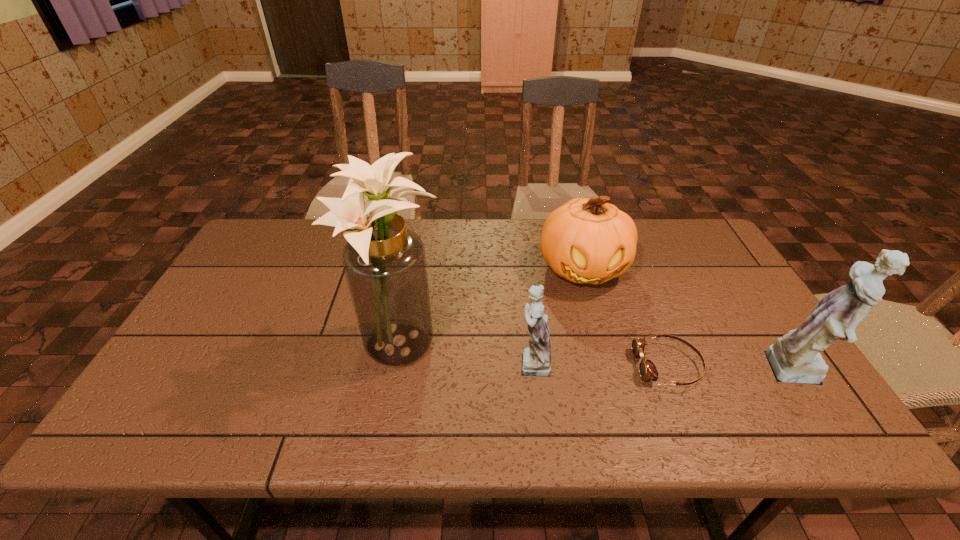
Image resolution: width=960 pixels, height=540 pixels. I want to click on free space located 0.140m on the front face of the farthest object, so click(602, 337).

Locate an element on the screen. The height and width of the screenshot is (540, 960). vacant space located 0.090m through the lenses of the goggles is located at coordinates (598, 366).

The width and height of the screenshot is (960, 540). What are the coordinates of `vacant region located through the lenses of the goggles` in the screenshot? It's located at (582, 366).

Find the location of a particular element. free spot located 0.350m through the lenses of the goggles is located at coordinates (491, 366).

Where is `vacant area located 0.260m on the right of the flower arrangement`? This screenshot has height=540, width=960. vacant area located 0.260m on the right of the flower arrangement is located at coordinates (546, 349).

The width and height of the screenshot is (960, 540). Find the location of `object positioned at the far edge`. object positioned at the far edge is located at coordinates (587, 240).

The width and height of the screenshot is (960, 540). In order to click on goggles at the near edge in this screenshot , I will do `click(647, 369)`.

Identify the location of flower arrangement located at the near edge. The height and width of the screenshot is (540, 960). (384, 262).

The height and width of the screenshot is (540, 960). What are the coordinates of `object located at the right edge` in the screenshot? It's located at (795, 358).

Locate an element on the screen. object that is at the near right corner is located at coordinates (795, 358).